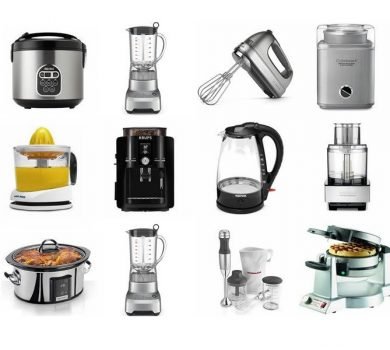
Locate an element on the screen. The height and width of the screenshot is (350, 390). light grey based transparent cylinder with small silver cylinder top is located at coordinates (348, 164).